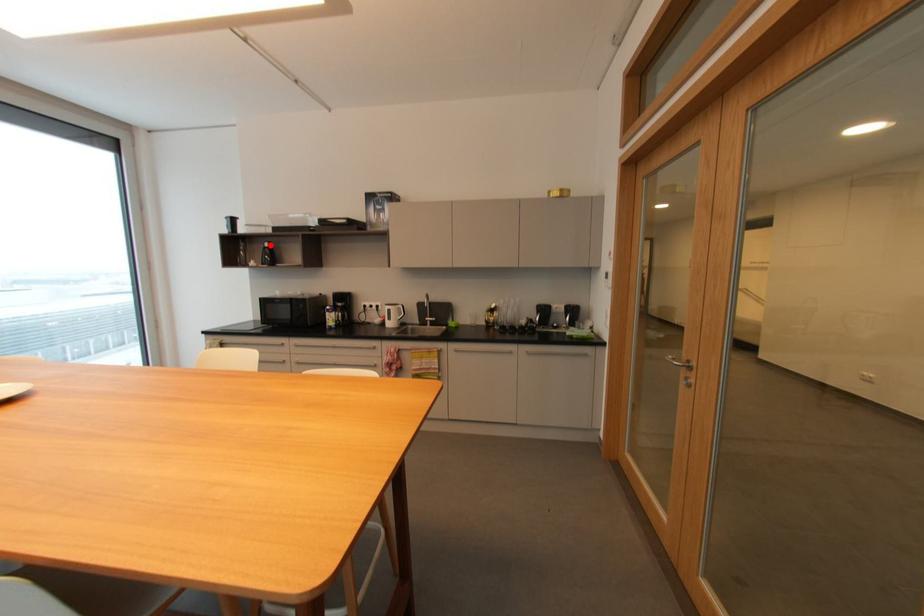
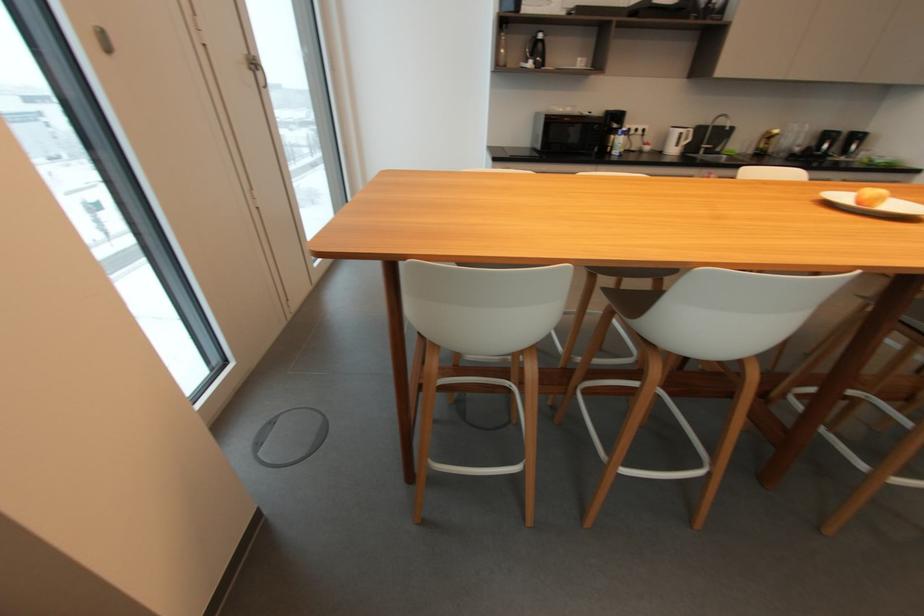
Locate, in the second image, the point that corresponds to the highlighted location in the first image.

(544, 36)